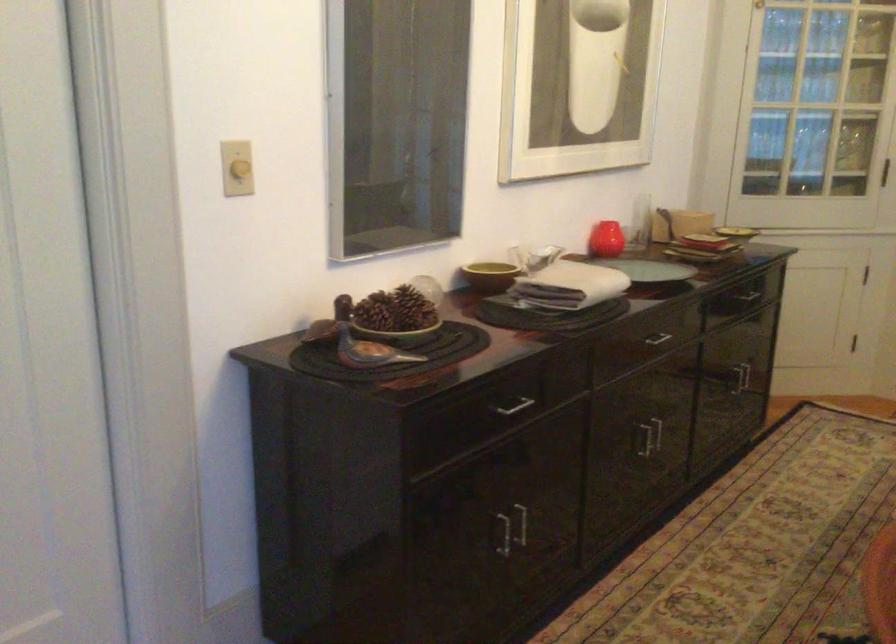
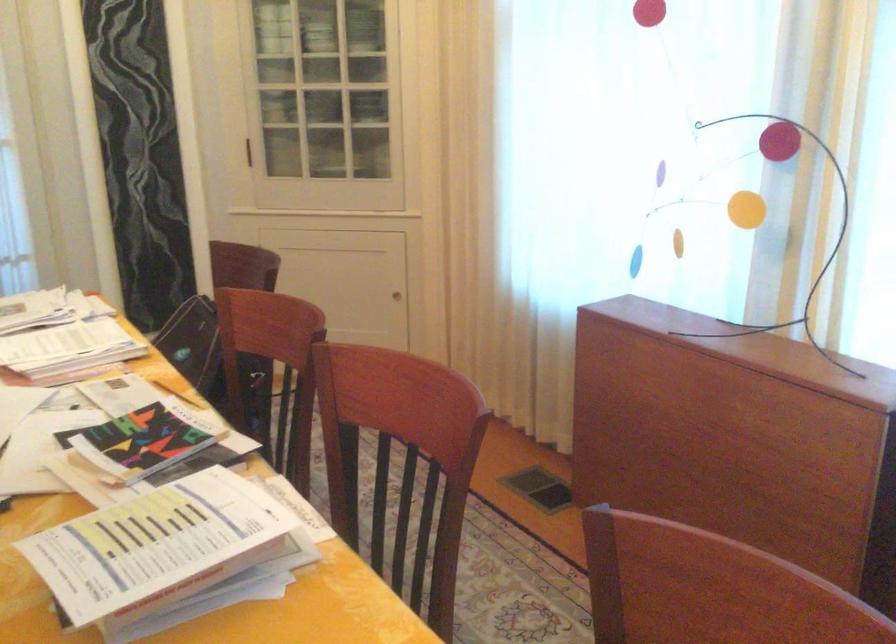
Question: The images are taken continuously from a first-person perspective. In which direction is your viewpoint rotating?

Choices:
 (A) Left
 (B) Right
 (C) Up
 (D) Down

Answer: (B)